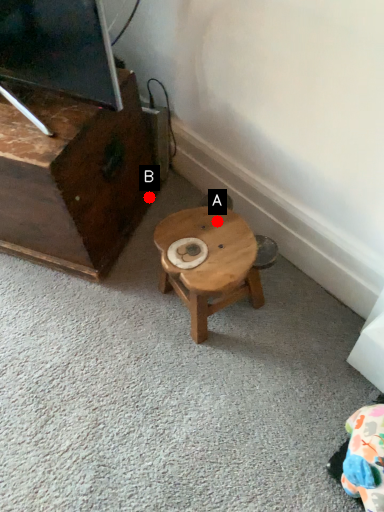
Question: Two points are circled on the image, labeled by A and B beside each circle. Which point is closer to the camera taking this photo?

Choices:
 (A) A is closer
 (B) B is closer

Answer: (A)